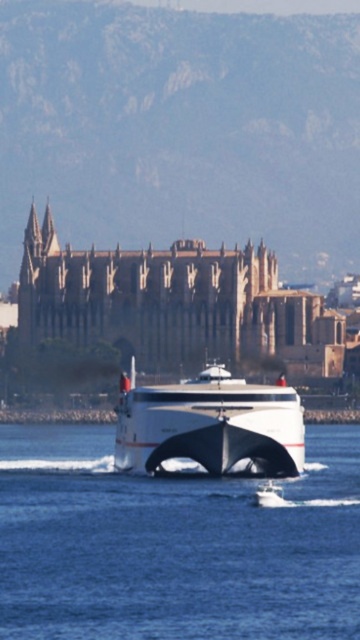
You are a photographer planning to capture the white glossy yacht at center against the backdrop of the historic stone cathedral. Considering the clear blue water at center is wider than the yacht, how should you frame the shot to ensure both the yacht and the cathedral are fully visible in the composition?

Since the clear blue water at center is wider than the white glossy yacht at center, position the yacht centrally so the broader water area can balance the composition while ensuring the cathedral in the background remains in frame.

You are a photographer trying to capture the entire white matte ship at center and the clear blue water at center in one shot. Considering their sizes, which one will occupy more of the frame?

The clear blue water at center has a larger size compared to the white matte ship at center, so it will occupy more of the frame.